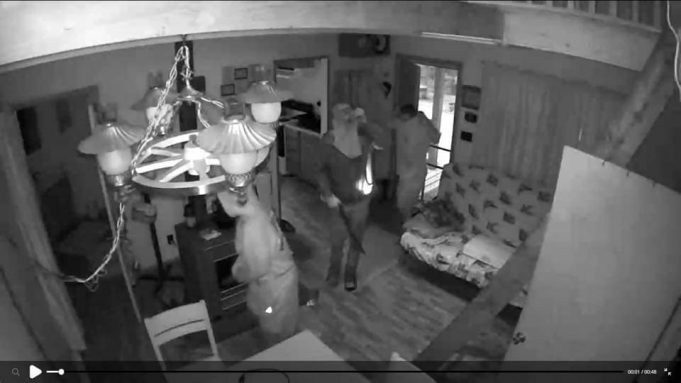
The height and width of the screenshot is (383, 681). What are the coordinates of `chair` in the screenshot? It's located at (178, 316).